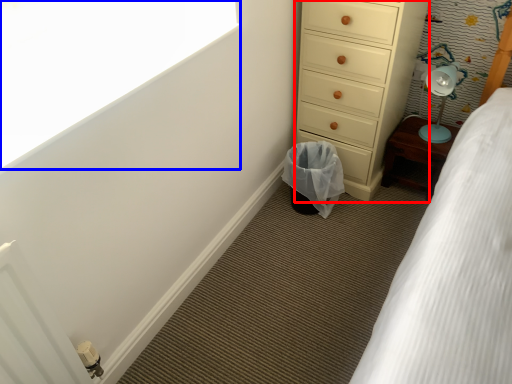
Question: Which point is further to the camera, chest of drawers (highlighted by a red box) or window screen (highlighted by a blue box)?

Choices:
 (A) chest of drawers
 (B) window screen

Answer: (A)